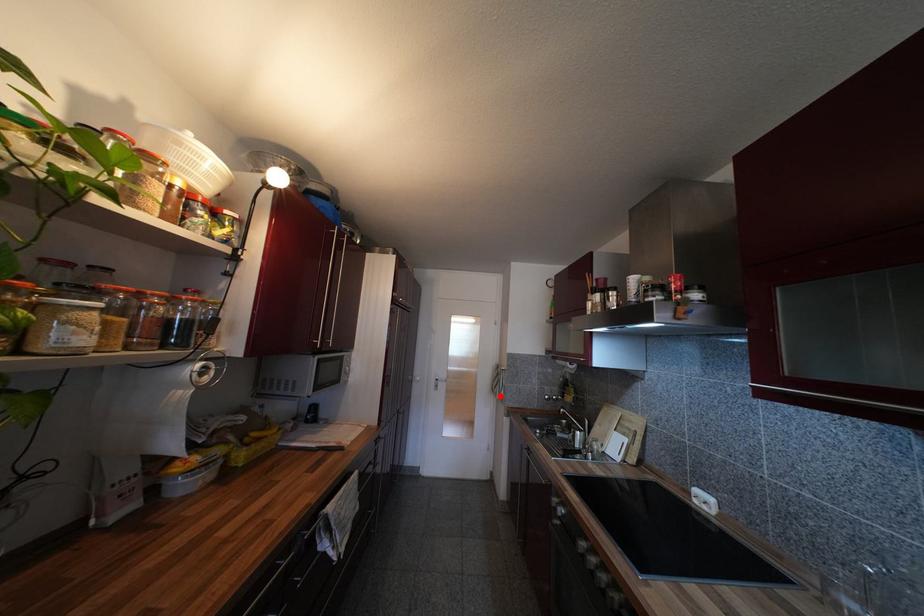
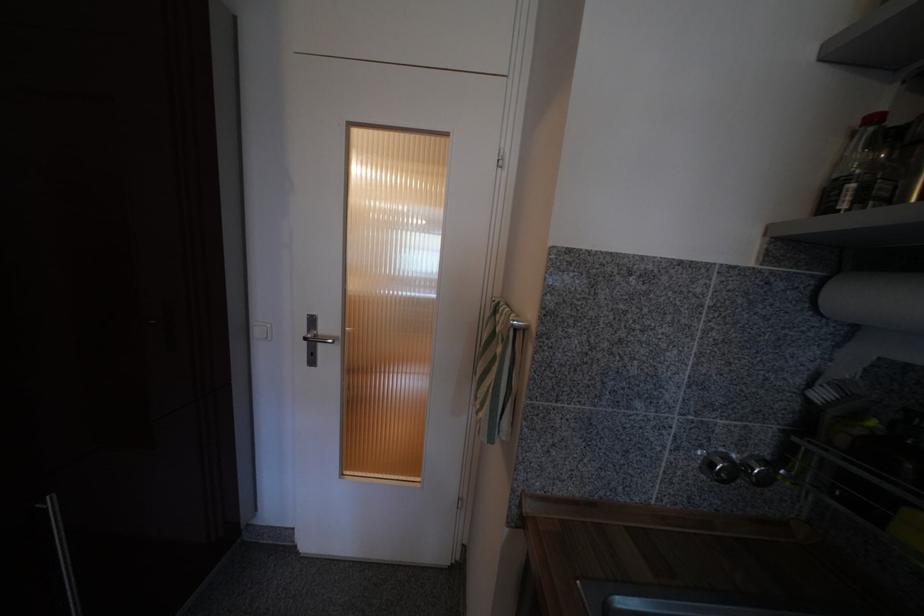
Find the pixel in the second image that matches the highlighted location in the first image.

(485, 407)